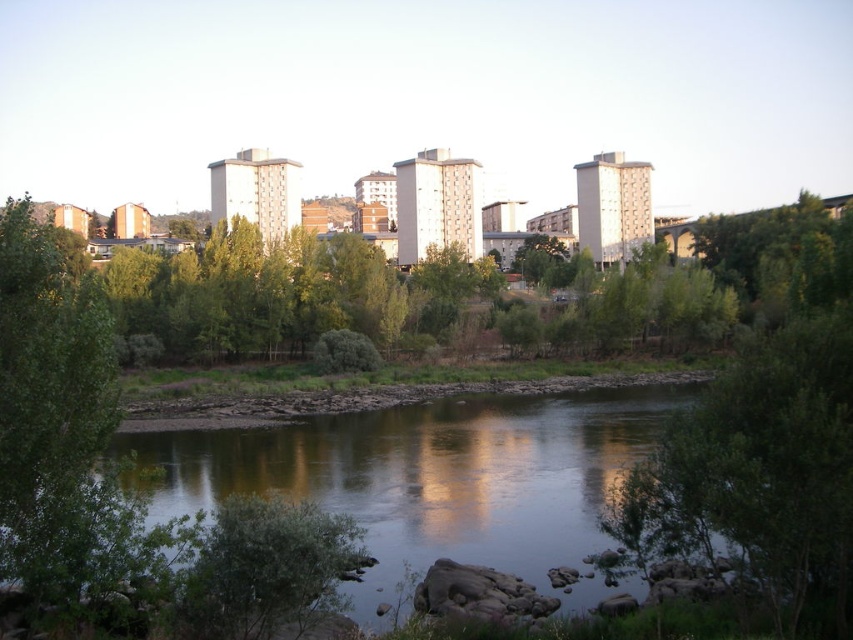
Who is positioned more to the left, smooth reflective water at center or green leafy tree at right?

smooth reflective water at center is more to the left.

Can you confirm if smooth reflective water at center is positioned above green leafy tree at right?

Actually, smooth reflective water at center is below green leafy tree at right.

Describe the element at coordinates (431, 480) in the screenshot. I see `smooth reflective water at center` at that location.

Image resolution: width=853 pixels, height=640 pixels. Find the location of `smooth reflective water at center`. smooth reflective water at center is located at coordinates (431, 480).